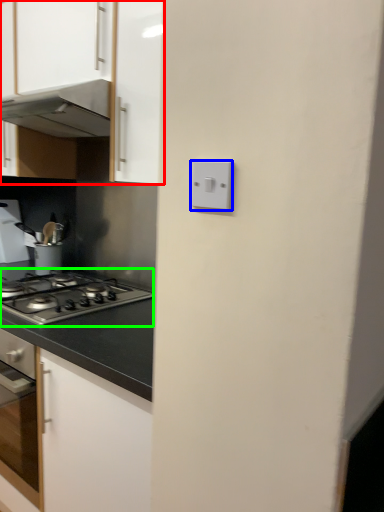
Question: Considering the real-world distances, which object is closest to cabinetry (highlighted by a red box)? light switch (highlighted by a blue box) or gas stove (highlighted by a green box).

Choices:
 (A) light switch
 (B) gas stove

Answer: (B)